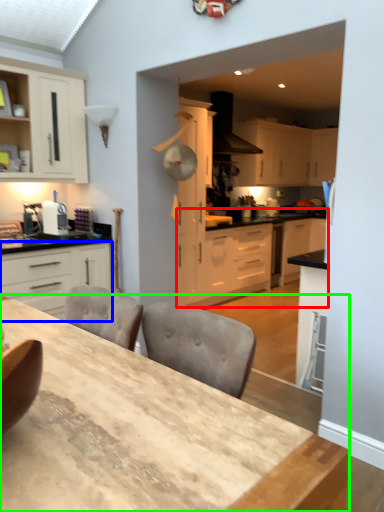
Question: Considering the real-world distances, which object is closest to counter (highlighted by a red box)? cabinetry (highlighted by a blue box) or table (highlighted by a green box).

Choices:
 (A) cabinetry
 (B) table

Answer: (A)